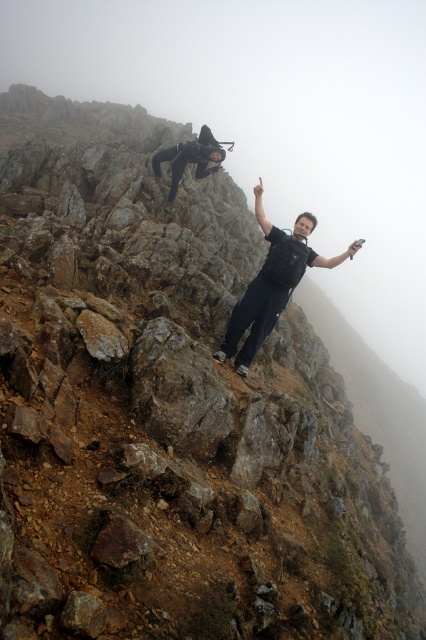
Question: Which point is farther from the camera taking this photo?

Choices:
 (A) (206, 163)
 (B) (285, 241)

Answer: (A)

Question: Can you confirm if black matte pants at center is positioned to the right of black matte wetsuit at upper center?

Choices:
 (A) no
 (B) yes

Answer: (B)

Question: Among these objects, which one is farthest from the camera?

Choices:
 (A) black matte wetsuit at upper center
 (B) black matte pants at center

Answer: (A)

Question: Can you confirm if black matte pants at center is positioned below black matte wetsuit at upper center?

Choices:
 (A) yes
 (B) no

Answer: (B)

Question: Where is black matte pants at center located in relation to black matte wetsuit at upper center in the image?

Choices:
 (A) left
 (B) right

Answer: (B)

Question: Which point appears closest to the camera in this image?

Choices:
 (A) (172, 163)
 (B) (304, 225)

Answer: (B)